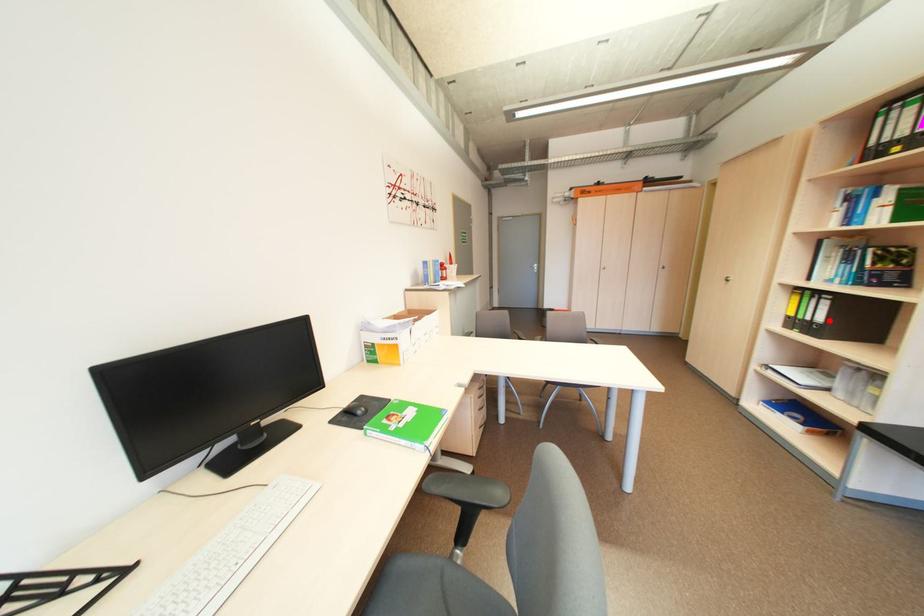
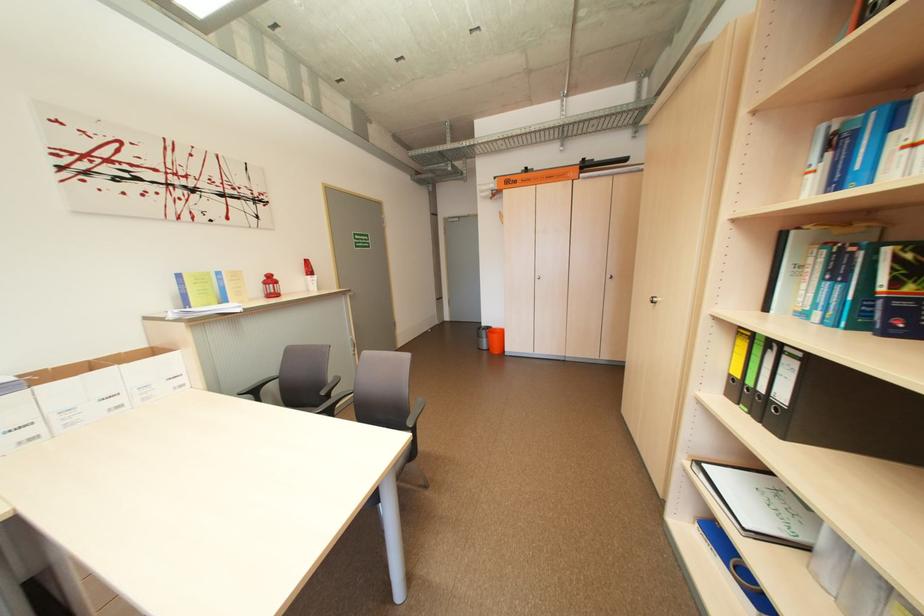
The point at the highlighted location is marked in the first image. Where is the corresponding point in the second image?

(792, 399)